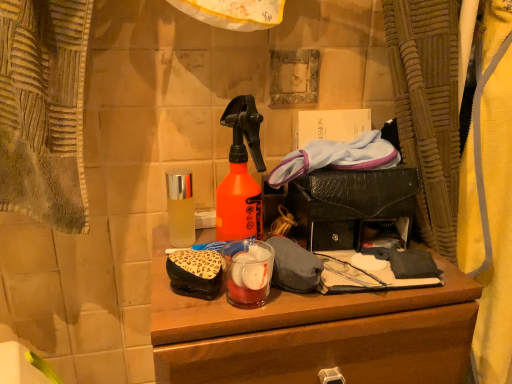
At what (x,y) coordinates should I click in order to perform the action: click on wooden desk at center. Please return your answer as a coordinate pair (x, y). The width and height of the screenshot is (512, 384). Looking at the image, I should click on (314, 333).

What do you see at coordinates (195, 273) in the screenshot? I see `leopard print fabric pouch at center` at bounding box center [195, 273].

Describe the element at coordinates (180, 207) in the screenshot. I see `clear glass bottle at center` at that location.

Locate an element on the screen. wooden desk at center is located at coordinates (314, 333).

In order to click on desk that appears on the right of clear glass bottle at center in this screenshot , I will do 314,333.

Which of these two, clear glass bottle at center or wooden desk at center, is smaller?

Smaller between the two is clear glass bottle at center.

From the image's perspective, is clear glass bottle at center beneath wooden desk at center?

No, from the image's perspective, clear glass bottle at center is not beneath wooden desk at center.

Is leopard print fabric pouch at center not close to wooden desk at center?

leopard print fabric pouch at center is near wooden desk at center, not far away.

Is leopard print fabric pouch at center taller or shorter than wooden desk at center?

Clearly, leopard print fabric pouch at center is shorter compared to wooden desk at center.

Which point is more distant from viewer, [210,283] or [347,333]?

The point [347,333] is behind.

From a real-world perspective, is wooden desk at center above or below clear glass bottle at center?

Clearly, from a real-world perspective, wooden desk at center is below clear glass bottle at center.

Could you tell me if wooden desk at center is turned towards clear glass bottle at center?

No, wooden desk at center is not aimed at clear glass bottle at center.

How different are the orientations of wooden desk at center and clear glass bottle at center in degrees?

0.112 degrees separate the facing orientations of wooden desk at center and clear glass bottle at center.

Is clear glass bottle at center surrounded by wooden desk at center?

Actually, clear glass bottle at center is outside wooden desk at center.

Does point (218, 283) come farther from viewer compared to point (182, 172)?

No, (218, 283) is closer to viewer.

In the image, is leopard print fabric pouch at center on the left side or the right side of clear glass bottle at center?

leopard print fabric pouch at center is to the right of clear glass bottle at center.

The height and width of the screenshot is (384, 512). I want to click on bottle above the leopard print fabric pouch at center (from a real-world perspective), so click(x=180, y=207).

Is wooden desk at center positioned far away from leopard print fabric pouch at center?

wooden desk at center is near leopard print fabric pouch at center, not far away.

From a real-world perspective, does wooden desk at center stand above leopard print fabric pouch at center?

No, from a real-world perspective, wooden desk at center is not over leopard print fabric pouch at center

Can you tell me how much wooden desk at center and leopard print fabric pouch at center differ in facing direction?

0.645 degrees separate the facing orientations of wooden desk at center and leopard print fabric pouch at center.

Based on their sizes in the image, would you say wooden desk at center is bigger or smaller than leopard print fabric pouch at center?

In the image, wooden desk at center appears to be larger than leopard print fabric pouch at center.

Is clear glass bottle at center positioned beyond the bounds of leopard print fabric pouch at center?

Result: Yes, clear glass bottle at center is outside of leopard print fabric pouch at center.

From the image's perspective, between clear glass bottle at center and leopard print fabric pouch at center, who is located below?

leopard print fabric pouch at center is shown below in the image.

Is clear glass bottle at center in contact with leopard print fabric pouch at center?

No, clear glass bottle at center is not beside leopard print fabric pouch at center.

Where is `bottle behind the wooden desk at center`? bottle behind the wooden desk at center is located at coordinates (180, 207).

Where is `desk lying on the right of leopard print fabric pouch at center`? desk lying on the right of leopard print fabric pouch at center is located at coordinates (314, 333).

Estimate the real-world distances between objects in this image. Which object is further from clear glass bottle at center, wooden desk at center or leopard print fabric pouch at center?

wooden desk at center.

Estimate the real-world distances between objects in this image. Which object is further from wooden desk at center, clear glass bottle at center or leopard print fabric pouch at center?

clear glass bottle at center is further to wooden desk at center.

Looking at the image, which one is located further to clear glass bottle at center, leopard print fabric pouch at center or wooden desk at center?

wooden desk at center lies further to clear glass bottle at center than the other object.

Based on their spatial positions, is wooden desk at center or clear glass bottle at center further from leopard print fabric pouch at center?

wooden desk at center.

Looking at the image, which one is located closer to leopard print fabric pouch at center, clear glass bottle at center or wooden desk at center?

clear glass bottle at center lies closer to leopard print fabric pouch at center than the other object.

From the image, which object appears to be farther from wooden desk at center, leopard print fabric pouch at center or clear glass bottle at center?

clear glass bottle at center.

Locate an element on the screen. The height and width of the screenshot is (384, 512). debris that lies between clear glass bottle at center and wooden desk at center from top to bottom is located at coordinates (195, 273).